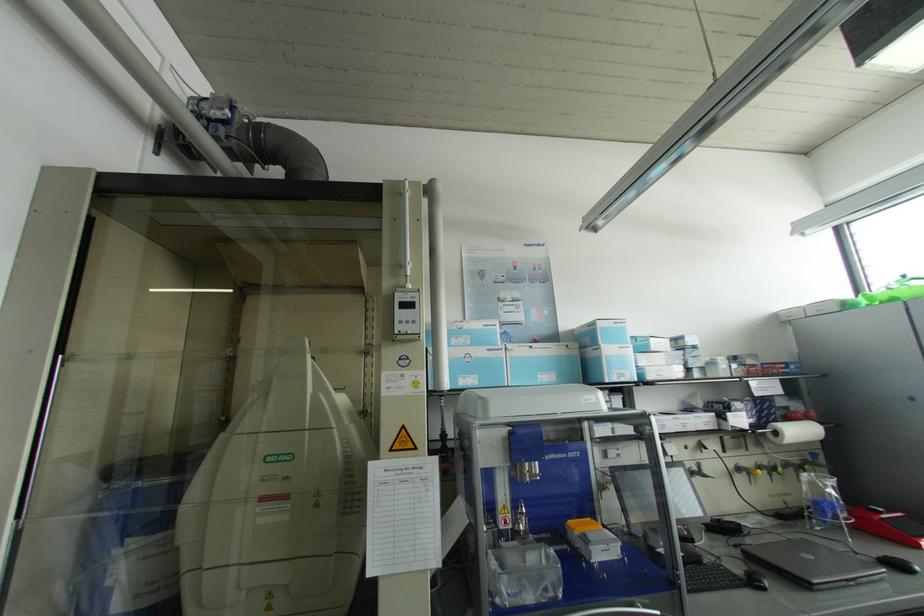
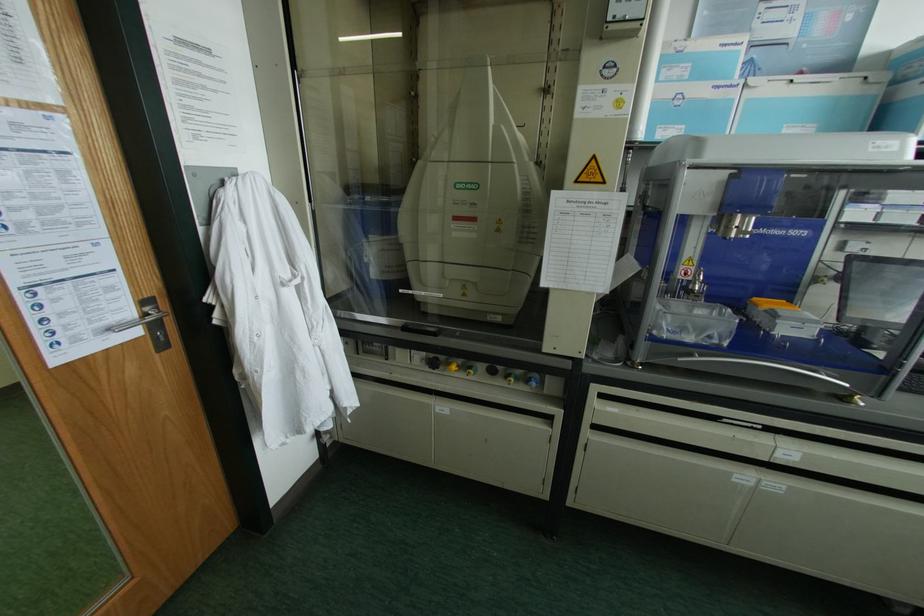
Find the pixel in the second image that matches (x=584, y=533) in the first image.

(772, 310)